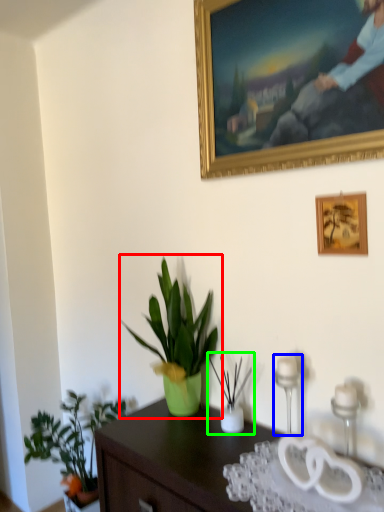
Question: Based on their relative distances, which object is nearer to houseplant (highlighted by a red box)? Choose from candle holder (highlighted by a blue box) and houseplant (highlighted by a green box).

Choices:
 (A) candle holder
 (B) houseplant

Answer: (B)